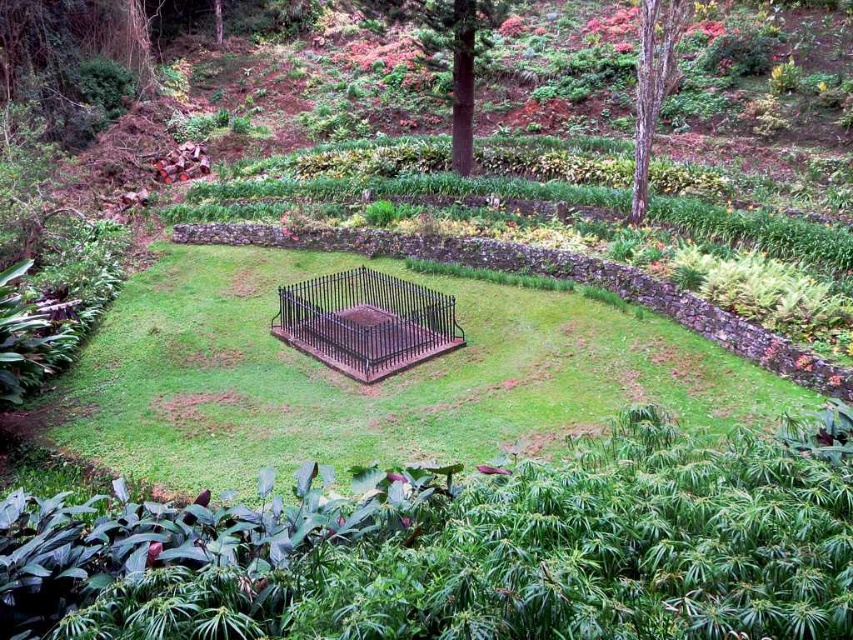
You are a gardener who needs to place a new decorative statue exactly at the center of the garden. The current central feature is the black wrought iron bird cage at center. Where should you place the statue relative to the bird cage?

The black wrought iron bird cage at center is already located at the center point of the garden, so the statue should be placed at the same location as the bird cage.

You are standing at the entrance of the garden and want to locate the green leafy plants at lower center. According to the coordinates provided, where exactly are they positioned?

The green leafy plants at lower center are positioned at coordinates point (463,547).

You are a gardener who wants to place a new flower pot between the green leafy plants at lower center and the black wrought iron bird cage at center. Based on their positions, which side of the bird cage should you place the flower pot?

The green leafy plants at lower center are positioned to the right of the black wrought iron bird cage at center, so placing the flower pot to the right side of the bird cage would align it with the plants.